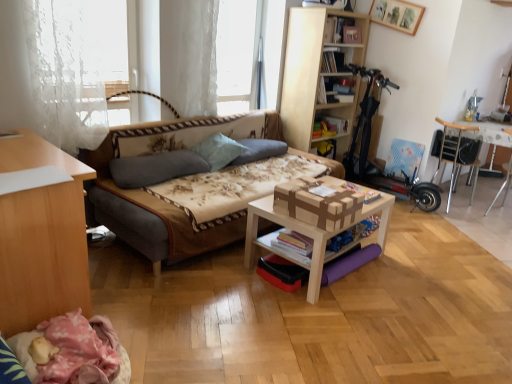
Question: Is light blue fabric pillow at center, which appears as the second pillow when viewed from the left, bigger or smaller than hardcover book at upper center, positioned as the 3th book in back-to-front order?

Choices:
 (A) big
 (B) small

Answer: (B)

Question: Is light blue fabric pillow at center, which appears as the second pillow when viewed from the left, taller or shorter than hardcover book at upper center, which is counted as the 2th book, starting from the front?

Choices:
 (A) short
 (B) tall

Answer: (B)

Question: Based on their relative distances, which object is farther from the light brown wooden table at center, which is the first table in left-to-right order?

Choices:
 (A) hardcover book at center, which is the first book in bottom-to-top order
 (B) metallic silver table at right, which is the first table in right-to-left order
 (C) light wood bookshelf at upper center
 (D) hardcover book at upper center, which is counted as the 2th book, starting from the front
 (E) wooden picture frame at upper center

Answer: (B)

Question: Estimate the real-world distances between objects in this image. Which object is farther from the wooden picture frame at upper center?

Choices:
 (A) fluffy fabric pillow at center, which is the 3th pillow from left to right
 (B) matte cardboard book at upper center, the 2th book when ordered from bottom to top
 (C) wooden chair at right
 (D) hardcover book at center, marked as the 4th book in a top-to-bottom arrangement
 (E) hardcover book at upper center, the 4th book when ordered from bottom to top

Answer: (D)